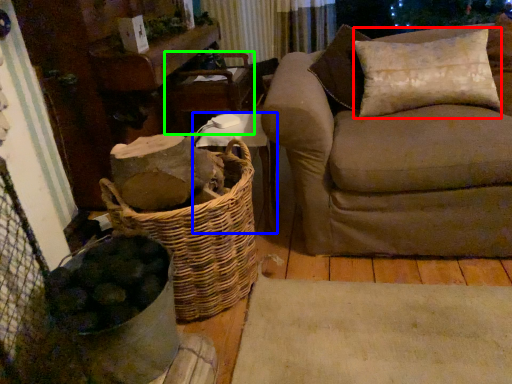
Question: Estimate the real-world distances between objects in this image. Which object is farther from pillow (highlighted by a red box), furniture (highlighted by a blue box) or armchair (highlighted by a green box)?

Choices:
 (A) furniture
 (B) armchair

Answer: (B)